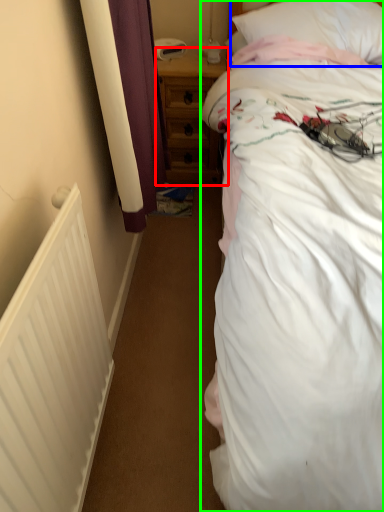
Question: Considering the real-world distances, which object is farthest from nightstand (highlighted by a red box)? pillow (highlighted by a blue box) or bed (highlighted by a green box)?

Choices:
 (A) pillow
 (B) bed

Answer: (B)